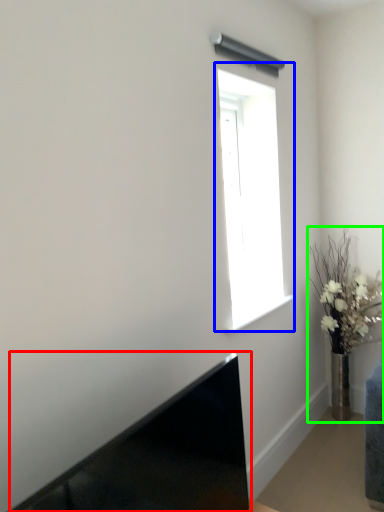
Question: Which is farther away from laptop (highlighted by a red box)? window (highlighted by a blue box) or houseplant (highlighted by a green box)?

Choices:
 (A) window
 (B) houseplant

Answer: (B)